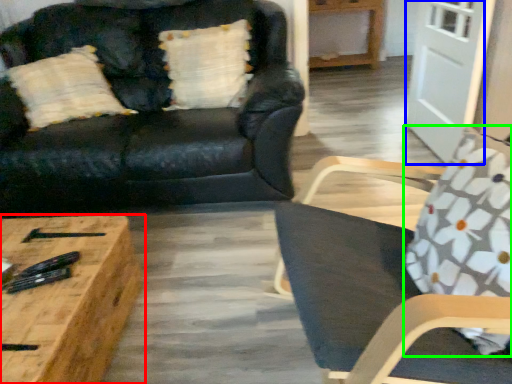
Question: Which object is positioned farthest from coffee table (highlighted by a red box)? Select from glass door (highlighted by a blue box) and throw pillow (highlighted by a green box).

Choices:
 (A) glass door
 (B) throw pillow

Answer: (A)